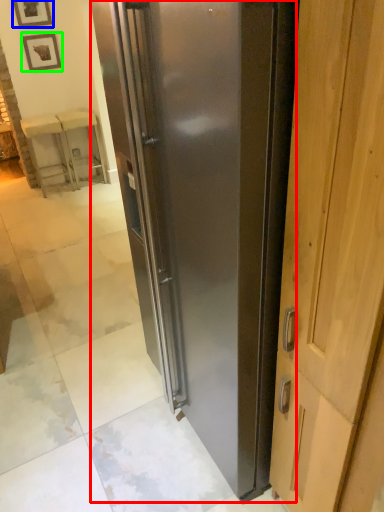
Question: Which object is positioned closest to refrigerator (highlighted by a red box)? Select from picture frame (highlighted by a blue box) and picture frame (highlighted by a green box).

Choices:
 (A) picture frame
 (B) picture frame

Answer: (B)